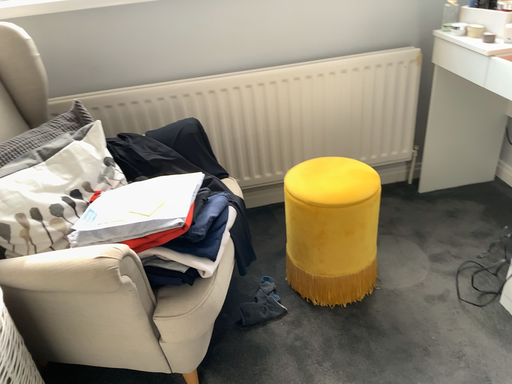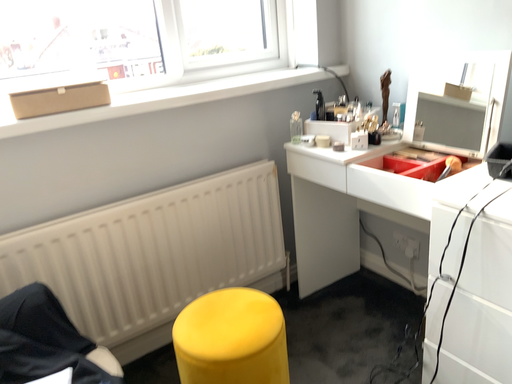
Question: Which way did the camera rotate in the video?

Choices:
 (A) rotated downward
 (B) rotated upward

Answer: (B)